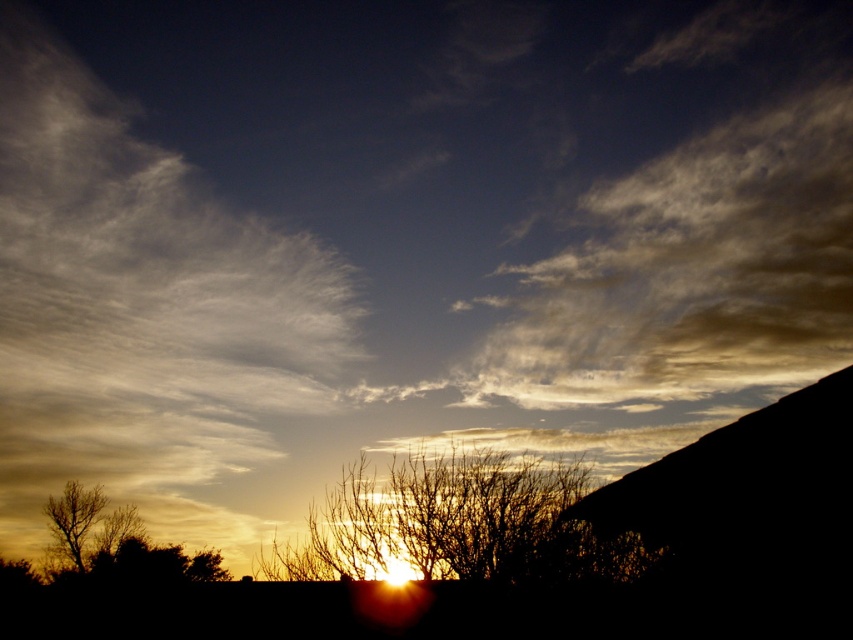
You are standing in the field and want to take a photo of the silhouette bare tree at center. If you are currently 17.11 meters away from it, is this a good distance for capturing the entire tree in your camera frame?

The silhouette bare tree at center is 17.11 meters away from the viewer. Whether this distance is good for capturing the entire tree depends on your camera settings and lens. However, since the tree is in the foreground of the sunset scene, being at this distance allows the tree to be clearly visible against the vibrant sky backdrop without being too close to obscure details or too far to become too small in the frame.

You are an artist trying to paint this sunset scene. You want to ensure the silhouette bare tree at center and the brown matte tree at lower left are proportionally accurate. Which tree should you draw with a narrower width?

The silhouette bare tree at center should be drawn with a narrower width since it has a lesser width compared to the brown matte tree at lower left according to the description.